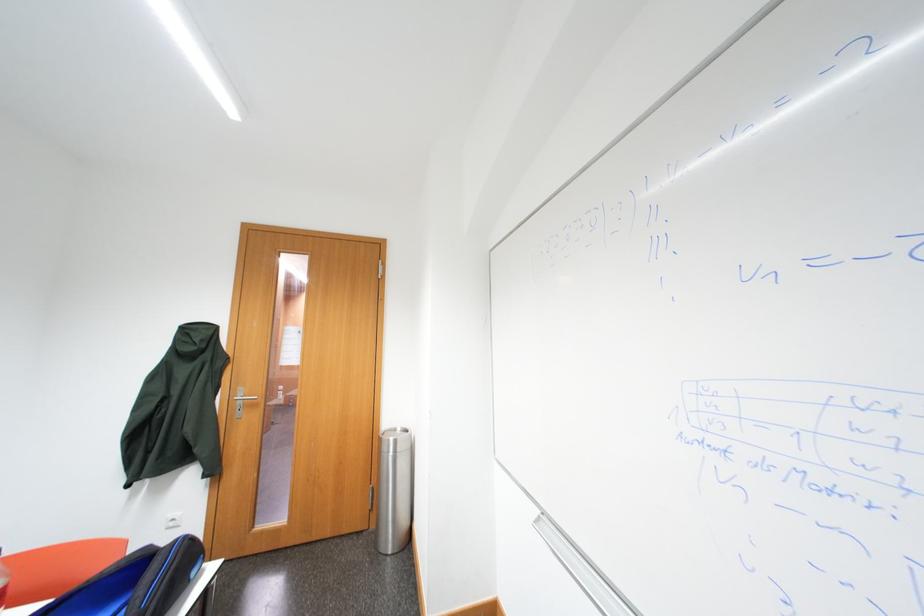
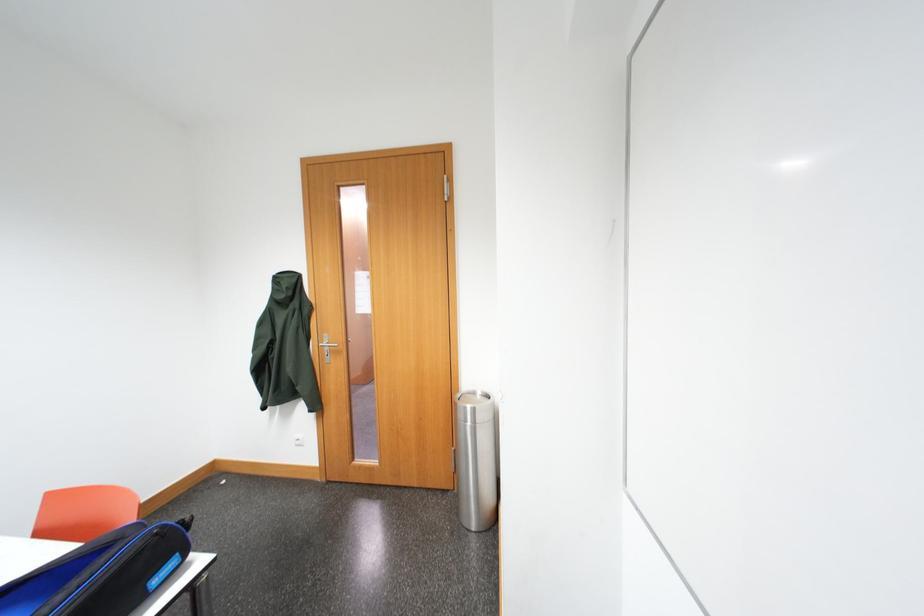
Question: The images are taken continuously from a first-person perspective. In which direction are you moving?

Choices:
 (A) Left
 (B) Right
 (C) Forward
 (D) Backward

Answer: (C)